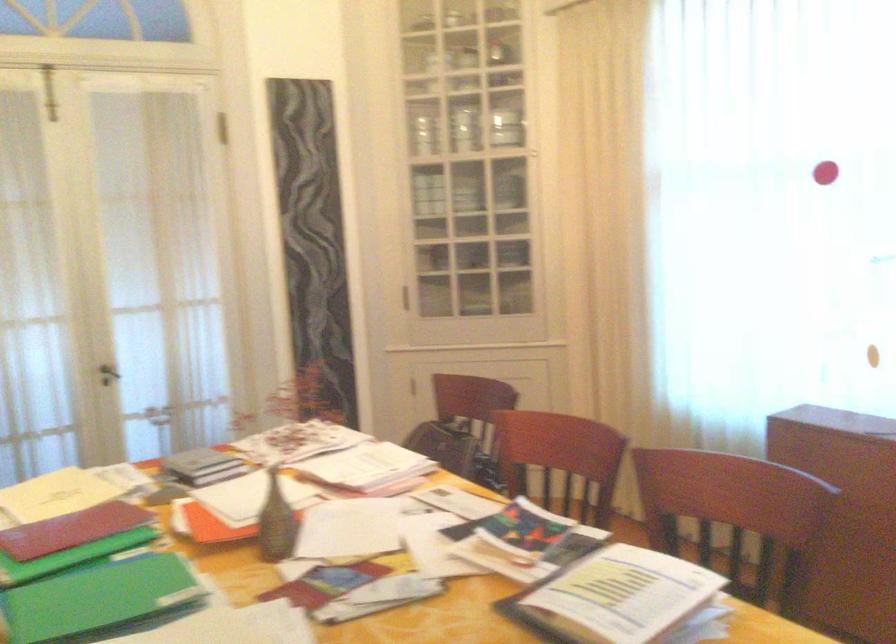
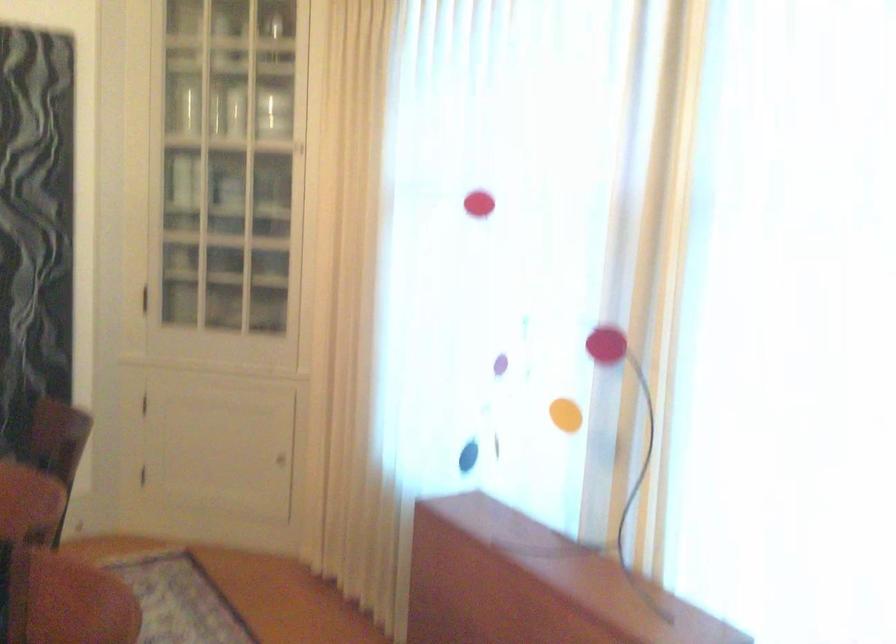
Where in the second image is the point corresponding to (531,149) from the first image?

(298, 147)